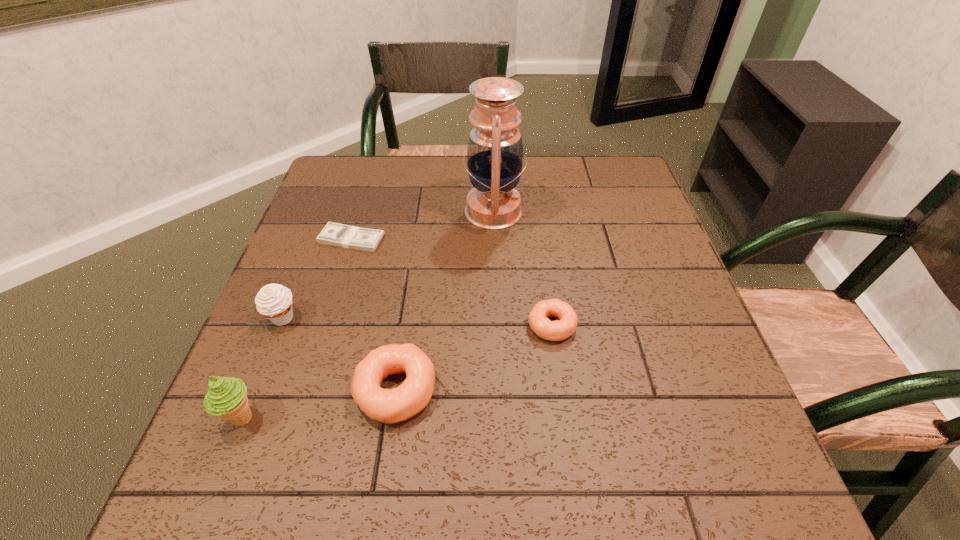
Locate an element on the screen. the taller doughnut is located at coordinates (388, 406).

At what (x,y) coordinates should I click in order to perform the action: click on the third object from right to left. Please return your answer as a coordinate pair (x, y). The height and width of the screenshot is (540, 960). Looking at the image, I should click on (388, 406).

I want to click on the fifth tallest object, so click(x=557, y=330).

Where is `the shorter doughnut`? The width and height of the screenshot is (960, 540). the shorter doughnut is located at coordinates (557, 330).

Where is `the shortest object`? This screenshot has width=960, height=540. the shortest object is located at coordinates (334, 234).

Where is `oil lamp`? Image resolution: width=960 pixels, height=540 pixels. oil lamp is located at coordinates (495, 153).

Find the location of a particular element. This screenshot has width=960, height=540. the third tallest object is located at coordinates (274, 301).

The image size is (960, 540). In order to click on icecream in this screenshot , I will do `click(226, 397)`.

Find the location of a particular element. This screenshot has height=540, width=960. blank area located 0.090m on the left of the fourth tallest object is located at coordinates (306, 390).

Image resolution: width=960 pixels, height=540 pixels. Identify the location of vacant region located on the left of the right doughnut. (393, 325).